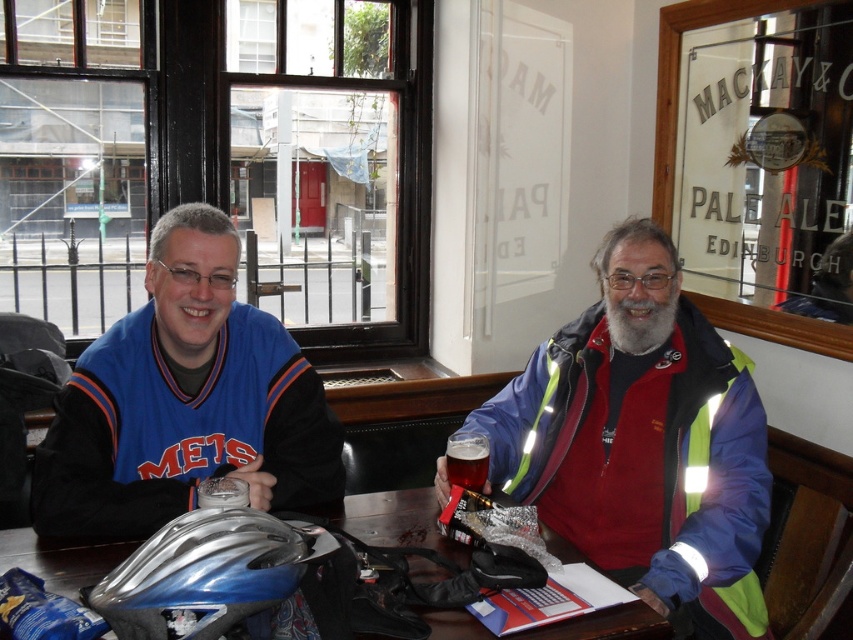
Question: Can you confirm if blue jersey at center is wider than metallic blue helmet at center?

Choices:
 (A) no
 (B) yes

Answer: (B)

Question: Which point appears closest to the camera in this image?

Choices:
 (A) (454, 452)
 (B) (143, 481)
 (C) (625, 348)
 (D) (529, 362)

Answer: (B)

Question: Which of these objects is positioned closest to the blue jersey at left?

Choices:
 (A) silver/glossy bicycle helmet at lower left
 (B) reflective blue jacket at right
 (C) metallic blue helmet at center

Answer: (B)

Question: Which point is closer to the camera taking this photo?

Choices:
 (A) (428, 488)
 (B) (265, 584)
 (C) (544, 432)
 (D) (241, 464)

Answer: (B)

Question: Is blue jersey at left below blue jersey at center?

Choices:
 (A) no
 (B) yes

Answer: (B)

Question: Does reflective blue jacket at right appear on the left side of amber glass beer at center?

Choices:
 (A) yes
 (B) no

Answer: (B)